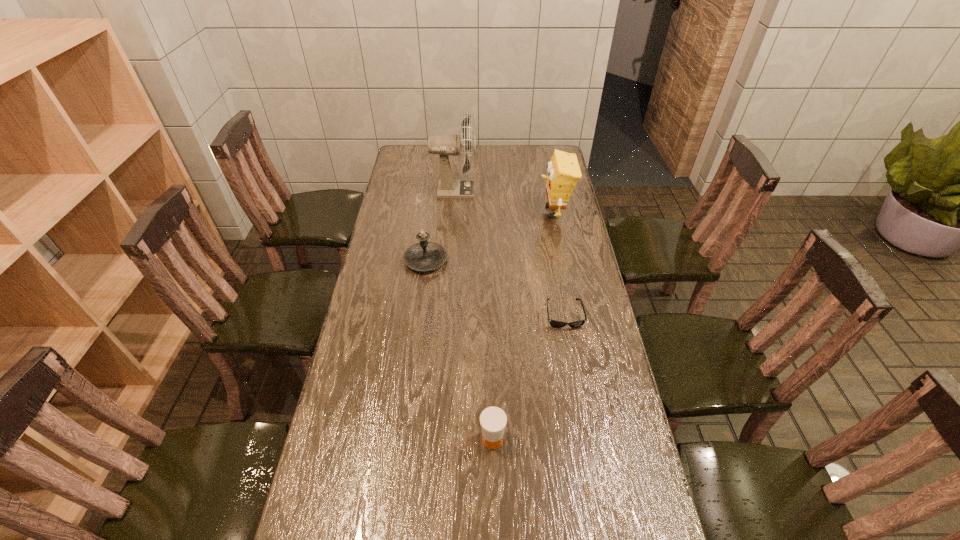
Identify the location of fan. This screenshot has width=960, height=540. (444, 145).

Image resolution: width=960 pixels, height=540 pixels. What are the coordinates of `the fourth shortest object` in the screenshot? It's located at (563, 172).

Where is `candle`? candle is located at coordinates (424, 256).

Locate an element on the screen. Image resolution: width=960 pixels, height=540 pixels. the third nearest object is located at coordinates (424, 256).

At what (x,y) coordinates should I click in order to perform the action: click on the third object from left to right. Please return your answer as a coordinate pair (x, y). The image size is (960, 540). Looking at the image, I should click on (493, 420).

Where is `the nearest object`? the nearest object is located at coordinates (493, 420).

Locate an element on the screen. This screenshot has width=960, height=540. the shortest object is located at coordinates (558, 324).

What are the coordinates of `the fourth farthest object` in the screenshot? It's located at click(558, 324).

The image size is (960, 540). I want to click on vacant area situated 0.210m on the air flow direction of the tallest object, so click(522, 191).

The height and width of the screenshot is (540, 960). Find the location of `vacant space located 0.140m on the face of the second tallest object`. vacant space located 0.140m on the face of the second tallest object is located at coordinates (505, 212).